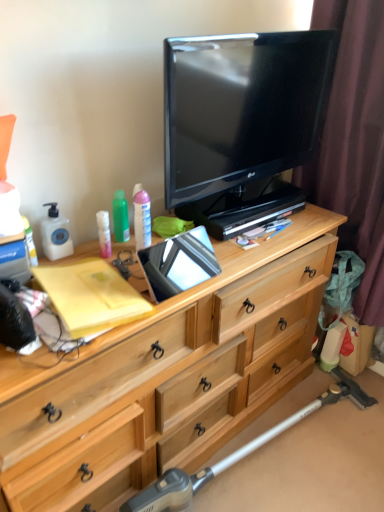
This screenshot has height=512, width=384. Identify the location of brown fabric curtain at right. (354, 144).

What is the approximate height of matte plastic lotion at center, the third toiletry viewed from the left?

The height of matte plastic lotion at center, the third toiletry viewed from the left, is 7.44 inches.

What do you see at coordinates (242, 123) in the screenshot? This screenshot has width=384, height=512. I see `black glossy tv at upper center` at bounding box center [242, 123].

The width and height of the screenshot is (384, 512). Describe the element at coordinates (164, 378) in the screenshot. I see `light wood dresser at center` at that location.

The width and height of the screenshot is (384, 512). Describe the element at coordinates (238, 452) in the screenshot. I see `metallic silver vacuum cleaner at lower right` at that location.

Image resolution: width=384 pixels, height=512 pixels. Find the location of `brown fabric curtain at right`. brown fabric curtain at right is located at coordinates (354, 144).

From a real-world perspective, who is located lower, matte plastic lotion at left, arranged as the third toiletry when viewed from the right, or green plastic bottle at upper left, marked as the second toiletry in a right-to-left arrangement?

matte plastic lotion at left, arranged as the third toiletry when viewed from the right, from a real-world perspective.

Considering the sizes of objects matte plastic lotion at left, which is counted as the 1th toiletry, starting from the left, and green plastic bottle at upper left, marked as the second toiletry in a right-to-left arrangement, in the image provided, who is bigger, matte plastic lotion at left, which is counted as the 1th toiletry, starting from the left, or green plastic bottle at upper left, marked as the second toiletry in a right-to-left arrangement,?

With larger size is green plastic bottle at upper left, marked as the second toiletry in a right-to-left arrangement.

From the image's perspective, is matte plastic lotion at left, arranged as the third toiletry when viewed from the right, over green plastic bottle at upper left, marked as the second toiletry in a right-to-left arrangement?

No, from the image's perspective, matte plastic lotion at left, arranged as the third toiletry when viewed from the right, is not over green plastic bottle at upper left, marked as the second toiletry in a right-to-left arrangement.

Consider the image. Which is more to the right, matte plastic lotion at left, arranged as the third toiletry when viewed from the right, or green plastic bottle at upper left, marked as the second toiletry in a right-to-left arrangement?

Positioned to the right is green plastic bottle at upper left, marked as the second toiletry in a right-to-left arrangement.

Is point (181, 47) closer or farther from the camera than point (30, 228)?

Point (181, 47) is positioned closer to the camera compared to point (30, 228).

From the picture: Considering the sizes of objects black glossy tv at upper center and matte plastic lotion at left, arranged as the third toiletry when viewed from the right, in the image provided, who is smaller, black glossy tv at upper center or matte plastic lotion at left, arranged as the third toiletry when viewed from the right,?

With smaller size is matte plastic lotion at left, arranged as the third toiletry when viewed from the right.

Are black glossy tv at upper center and matte plastic lotion at left, which is counted as the 1th toiletry, starting from the left, located far from each other?

No.

From the black glossy tv at upper center, count the 3rd toiletry to the left and point to it. Please provide its 2D coordinates.

[(30, 242)]

Considering the sizes of matte plastic lotion at center, the third toiletry viewed from the left, and brown fabric curtain at right in the image, is matte plastic lotion at center, the third toiletry viewed from the left, wider or thinner than brown fabric curtain at right?

Considering their sizes, matte plastic lotion at center, the third toiletry viewed from the left, looks slimmer than brown fabric curtain at right.

Is the position of matte plastic lotion at center, which is counted as the 1th toiletry, starting from the right, less distant than that of brown fabric curtain at right?

No, the depth of matte plastic lotion at center, which is counted as the 1th toiletry, starting from the right, is greater than that of brown fabric curtain at right.

Is matte plastic lotion at center, which is counted as the 1th toiletry, starting from the right, at the left side of brown fabric curtain at right?

Yes, matte plastic lotion at center, which is counted as the 1th toiletry, starting from the right, is to the left of brown fabric curtain at right.

From the image's perspective, is matte plastic lotion at center, which is counted as the 1th toiletry, starting from the right, located above or below brown fabric curtain at right?

From the image's perspective, matte plastic lotion at center, which is counted as the 1th toiletry, starting from the right, appears below brown fabric curtain at right.

Could you measure the distance between green plastic bottle at upper left, which appears as the 2th toiletry when viewed from the left, and black glossy tv at upper center?

green plastic bottle at upper left, which appears as the 2th toiletry when viewed from the left, and black glossy tv at upper center are 19.54 inches apart.

Considering the relative positions of green plastic bottle at upper left, marked as the second toiletry in a right-to-left arrangement, and black glossy tv at upper center in the image provided, is green plastic bottle at upper left, marked as the second toiletry in a right-to-left arrangement, to the left of black glossy tv at upper center from the viewer's perspective?

Yes.

Does green plastic bottle at upper left, marked as the second toiletry in a right-to-left arrangement, come behind black glossy tv at upper center?

Yes, green plastic bottle at upper left, marked as the second toiletry in a right-to-left arrangement, is further from the viewer.

From their relative heights in the image, would you say matte plastic lotion at left, arranged as the third toiletry when viewed from the right, is taller or shorter than light wood dresser at center?

In the image, matte plastic lotion at left, arranged as the third toiletry when viewed from the right, appears to be shorter than light wood dresser at center.

From the image's perspective, is matte plastic lotion at left, arranged as the third toiletry when viewed from the right, located above or below light wood dresser at center?

From the image's perspective, matte plastic lotion at left, arranged as the third toiletry when viewed from the right, appears above light wood dresser at center.

From the picture: Is matte plastic lotion at left, which is counted as the 1th toiletry, starting from the left, further to the viewer compared to light wood dresser at center?

Yes, it is.

Can we say matte plastic lotion at left, arranged as the third toiletry when viewed from the right, lies outside light wood dresser at center?

Absolutely, matte plastic lotion at left, arranged as the third toiletry when viewed from the right, is external to light wood dresser at center.

Does matte plastic lotion at center, the third toiletry viewed from the left, touch matte plastic lotion at left, arranged as the third toiletry when viewed from the right?

No, matte plastic lotion at center, the third toiletry viewed from the left, is not beside matte plastic lotion at left, arranged as the third toiletry when viewed from the right.

How different are the orientations of matte plastic lotion at center, which is counted as the 1th toiletry, starting from the right, and matte plastic lotion at left, which is counted as the 1th toiletry, starting from the left, in degrees?

There is a 2.83-degree angle between the facing directions of matte plastic lotion at center, which is counted as the 1th toiletry, starting from the right, and matte plastic lotion at left, which is counted as the 1th toiletry, starting from the left.

From a real-world perspective, does matte plastic lotion at center, the third toiletry viewed from the left, stand above matte plastic lotion at left, which is counted as the 1th toiletry, starting from the left?

Yes.

Which is in front, matte plastic lotion at center, which is counted as the 1th toiletry, starting from the right, or matte plastic lotion at left, which is counted as the 1th toiletry, starting from the left?

matte plastic lotion at left, which is counted as the 1th toiletry, starting from the left, is more forward.

Consider the image. Who is smaller, black glossy tv at upper center or light wood dresser at center?

black glossy tv at upper center.

Is black glossy tv at upper center outside of light wood dresser at center?

Yes, black glossy tv at upper center is not within light wood dresser at center.

Would you consider black glossy tv at upper center to be distant from light wood dresser at center?

No, black glossy tv at upper center is not far away from light wood dresser at center.

From a real-world perspective, who is located lower, black glossy tv at upper center or light wood dresser at center?

In real-world perspective, light wood dresser at center is lower.

Image resolution: width=384 pixels, height=512 pixels. Find the location of `toiletry on the left of the green plastic bottle at upper left, marked as the second toiletry in a right-to-left arrangement`. toiletry on the left of the green plastic bottle at upper left, marked as the second toiletry in a right-to-left arrangement is located at coordinates (30, 242).

Where is `the 1st toiletry behind the black glossy tv at upper center, counting from the anchor's position`? This screenshot has height=512, width=384. the 1st toiletry behind the black glossy tv at upper center, counting from the anchor's position is located at coordinates (30, 242).

Which object lies nearer to the anchor point metallic silver vacuum cleaner at lower right, matte plastic lotion at center, the third toiletry viewed from the left, or light wood dresser at center?

Based on the image, light wood dresser at center appears to be nearer to metallic silver vacuum cleaner at lower right.

Considering their positions, is black glossy tv at upper center positioned further to green plastic bottle at upper left, marked as the second toiletry in a right-to-left arrangement, than metallic silver vacuum cleaner at lower right?

metallic silver vacuum cleaner at lower right lies further to green plastic bottle at upper left, marked as the second toiletry in a right-to-left arrangement, than the other object.

Based on their spatial positions, is brown fabric curtain at right or matte plastic lotion at center, which is counted as the 1th toiletry, starting from the right, closer to green plastic bottle at upper left, marked as the second toiletry in a right-to-left arrangement?

Among the two, matte plastic lotion at center, which is counted as the 1th toiletry, starting from the right, is located nearer to green plastic bottle at upper left, marked as the second toiletry in a right-to-left arrangement.

Which object lies nearer to the anchor point brown fabric curtain at right, metallic silver vacuum cleaner at lower right or matte plastic lotion at left, which is counted as the 1th toiletry, starting from the left?

Among the two, metallic silver vacuum cleaner at lower right is located nearer to brown fabric curtain at right.

When comparing their distances from matte plastic lotion at left, arranged as the third toiletry when viewed from the right, does light wood dresser at center or brown fabric curtain at right seem further?

brown fabric curtain at right is further to matte plastic lotion at left, arranged as the third toiletry when viewed from the right.

Estimate the real-world distances between objects in this image. Which object is further from metallic silver vacuum cleaner at lower right, matte plastic lotion at left, which is counted as the 1th toiletry, starting from the left, or green plastic bottle at upper left, marked as the second toiletry in a right-to-left arrangement?

Among the two, matte plastic lotion at left, which is counted as the 1th toiletry, starting from the left, is located further to metallic silver vacuum cleaner at lower right.

From the image, which object appears to be nearer to green plastic bottle at upper left, which appears as the 2th toiletry when viewed from the left, matte plastic lotion at center, which is counted as the 1th toiletry, starting from the right, or metallic silver vacuum cleaner at lower right?

matte plastic lotion at center, which is counted as the 1th toiletry, starting from the right.

Considering their positions, is brown fabric curtain at right positioned further to matte plastic lotion at center, which is counted as the 1th toiletry, starting from the right, than black glossy tv at upper center?

brown fabric curtain at right is further to matte plastic lotion at center, which is counted as the 1th toiletry, starting from the right.

At what (x,y) coordinates should I click in order to perform the action: click on desk between green plastic bottle at upper left, which appears as the 2th toiletry when viewed from the left, and metallic silver vacuum cleaner at lower right in the up-down direction. Please return your answer as a coordinate pair (x, y). Looking at the image, I should click on point(164,378).

This screenshot has width=384, height=512. I want to click on desk situated between matte plastic lotion at center, the third toiletry viewed from the left, and brown fabric curtain at right from left to right, so click(x=164, y=378).

Locate an element on the screen. The height and width of the screenshot is (512, 384). curtain between black glossy tv at upper center and light wood dresser at center in the vertical direction is located at coordinates (354, 144).

Locate an element on the screen. This screenshot has height=512, width=384. television between matte plastic lotion at center, the third toiletry viewed from the left, and brown fabric curtain at right is located at coordinates (242, 123).